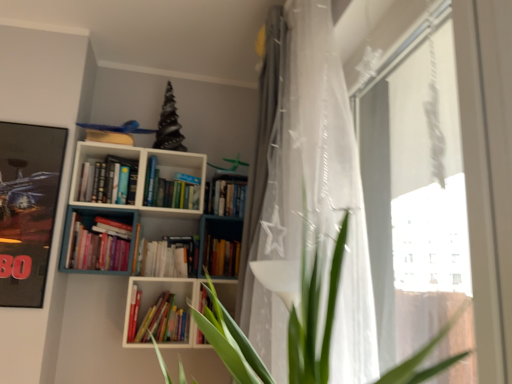
Question: Is transparent plastic curtain at right bigger or smaller than white sheer curtain at upper center, the second curtain in the front-to-back sequence?

Choices:
 (A) big
 (B) small

Answer: (B)

Question: In terms of width, does transparent plastic curtain at right look wider or thinner when compared to white sheer curtain at upper center, the second curtain in the front-to-back sequence?

Choices:
 (A) thin
 (B) wide

Answer: (A)

Question: Considering the real-world distances, which object is farthest from the white sheer curtain at center, placed as the 1th curtain when sorted from front to back?

Choices:
 (A) hardcover books at center, marked as the 3th book in a left-to-right arrangement
 (B) white sheer curtain at upper center, the second curtain in the front-to-back sequence
 (C) hardcover book at center, which is the second book in left-to-right order
 (D) white matte bookcase at upper center
 (E) hardcover books at center-left, the 4th book viewed from the right

Answer: (E)

Question: Which object is the farthest from the hardcover books at center, the second book from the top?

Choices:
 (A) white sheer curtain at center, the second curtain viewed from the back
 (B) transparent plastic curtain at right
 (C) white sheer curtain at upper center, the second curtain in the front-to-back sequence
 (D) hardcover book at center, arranged as the 4th book when viewed from the left
 (E) hardcover books at center-left, the 4th book viewed from the right

Answer: (B)